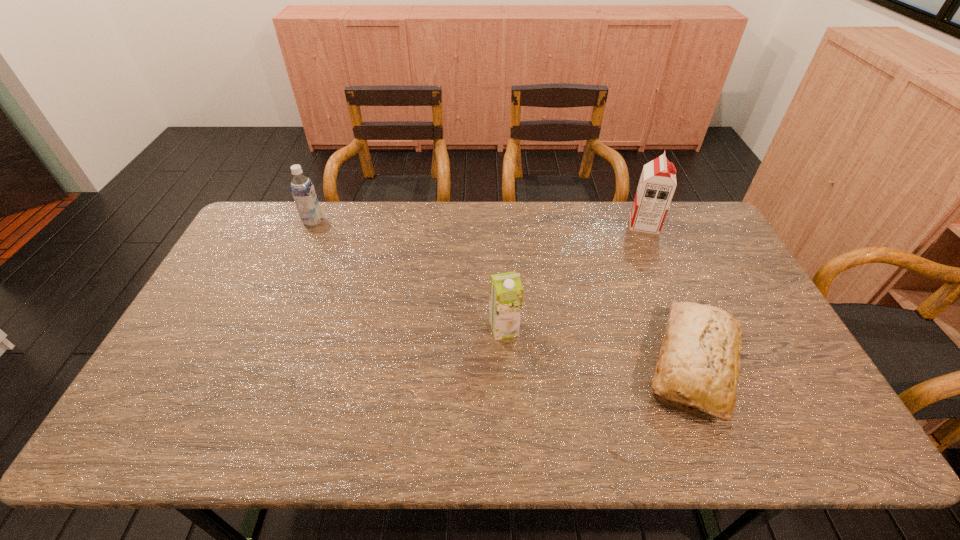
You are a GUI agent. You are given a task and a screenshot of the screen. Output one action in this format:
    pyautogui.click(x=<x>, y=<y>)
    Task: Click on the object at the near edge
    
    Given the screenshot: What is the action you would take?
    pyautogui.click(x=699, y=358)

I want to click on object that is at the right edge, so click(699, 358).

At what (x,y) coordinates should I click in order to perform the action: click on object that is at the near right corner. Please return your answer as a coordinate pair (x, y). The width and height of the screenshot is (960, 540). Looking at the image, I should click on (699, 358).

Locate an element on the screen. The height and width of the screenshot is (540, 960). free space at the far edge of the desktop is located at coordinates [x=496, y=229].

Identify the location of vacant area at the near edge. (309, 437).

You are a GUI agent. You are given a task and a screenshot of the screen. Output one action in this format:
    pyautogui.click(x=<x>, y=<y>)
    Task: Click on the vacant space at the left edge of the desktop
    The width and height of the screenshot is (960, 540).
    Given the screenshot: What is the action you would take?
    pyautogui.click(x=219, y=353)

Where is `vacant space at the right edge of the desktop`? The width and height of the screenshot is (960, 540). vacant space at the right edge of the desktop is located at coordinates (688, 261).

The image size is (960, 540). In the image, there is a desktop. Find the location of `vacant space at the far left corner`. vacant space at the far left corner is located at coordinates (271, 243).

You are a GUI agent. You are given a task and a screenshot of the screen. Output one action in this format:
    pyautogui.click(x=<x>, y=<y>)
    Task: Click on the vacant area at the far right corner
    
    Given the screenshot: What is the action you would take?
    pyautogui.click(x=669, y=228)

Find the location of a particular element. free space between the tallest soya milk and the second soya milk from right to left is located at coordinates (574, 276).